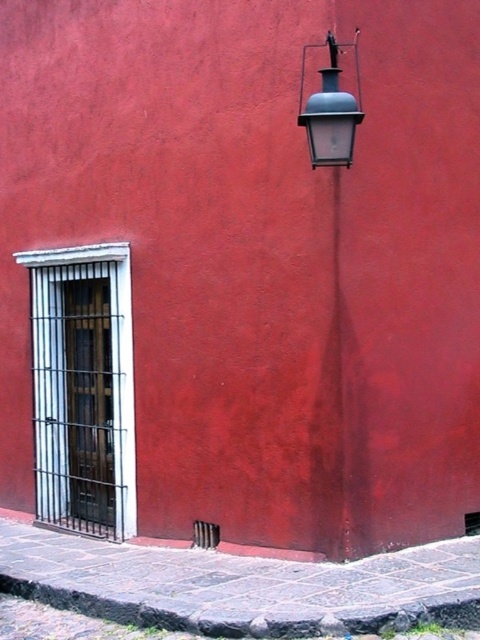
Question: Where is matte blue glass lamp at upper right located in relation to matte gray lantern at upper right in the image?

Choices:
 (A) left
 (B) right

Answer: (B)

Question: Which of the following is the closest to the observer?

Choices:
 (A) (337, 132)
 (B) (338, 429)

Answer: (A)

Question: Does matte blue glass lamp at upper right have a smaller size compared to matte gray lantern at upper right?

Choices:
 (A) no
 (B) yes

Answer: (B)

Question: Observing the image, what is the correct spatial positioning of matte blue glass lamp at upper right in reference to matte gray lantern at upper right?

Choices:
 (A) above
 (B) below

Answer: (B)

Question: Among these points, which one is farthest from the camera?

Choices:
 (A) (350, 506)
 (B) (330, 150)

Answer: (A)

Question: Which point is closer to the camera?

Choices:
 (A) matte blue glass lamp at upper right
 (B) matte gray lantern at upper right

Answer: (B)